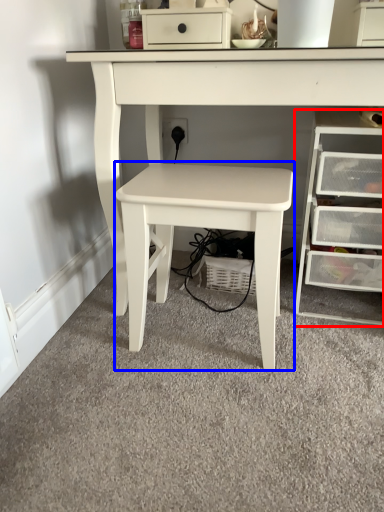
Question: Which object is closer to the camera taking this photo, chest of drawers (highlighted by a red box) or table (highlighted by a blue box)?

Choices:
 (A) chest of drawers
 (B) table

Answer: (B)